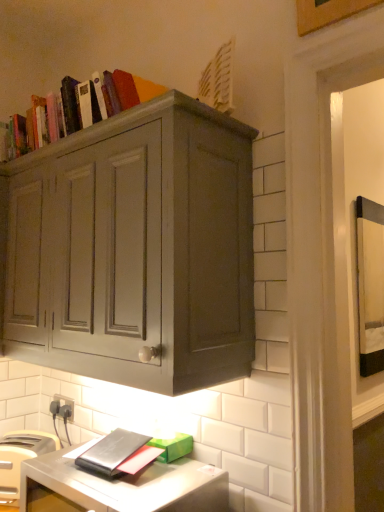
Question: Is wooden picture frame at upper right wider than matte gray cabinet at upper center?

Choices:
 (A) yes
 (B) no

Answer: (B)

Question: Is wooden picture frame at upper right with matte gray cabinet at upper center?

Choices:
 (A) no
 (B) yes

Answer: (A)

Question: Is the position of wooden picture frame at upper right more distant than that of matte gray cabinet at upper center?

Choices:
 (A) no
 (B) yes

Answer: (B)

Question: Could you tell me if wooden picture frame at upper right is turned towards matte gray cabinet at upper center?

Choices:
 (A) no
 (B) yes

Answer: (A)

Question: Is wooden picture frame at upper right not close to matte gray cabinet at upper center?

Choices:
 (A) yes
 (B) no

Answer: (B)

Question: From the image's perspective, is wooden picture frame at upper right positioned above or below white plastic toaster at lower left?

Choices:
 (A) above
 (B) below

Answer: (A)

Question: Is wooden picture frame at upper right wider or thinner than white plastic toaster at lower left?

Choices:
 (A) thin
 (B) wide

Answer: (A)

Question: Based on their positions, is wooden picture frame at upper right located to the left or right of white plastic toaster at lower left?

Choices:
 (A) left
 (B) right

Answer: (B)

Question: Considering the positions of wooden picture frame at upper right and white plastic toaster at lower left in the image, is wooden picture frame at upper right taller or shorter than white plastic toaster at lower left?

Choices:
 (A) short
 (B) tall

Answer: (B)

Question: Considering the positions of black plastic electric outlet at lower left and white plastic toaster at lower left in the image, is black plastic electric outlet at lower left taller or shorter than white plastic toaster at lower left?

Choices:
 (A) short
 (B) tall

Answer: (A)

Question: From the image's perspective, is black plastic electric outlet at lower left located above or below white plastic toaster at lower left?

Choices:
 (A) above
 (B) below

Answer: (A)

Question: From a real-world perspective, is black plastic electric outlet at lower left positioned above or below white plastic toaster at lower left?

Choices:
 (A) above
 (B) below

Answer: (A)

Question: Is black plastic electric outlet at lower left situated inside white plastic toaster at lower left or outside?

Choices:
 (A) outside
 (B) inside

Answer: (A)

Question: Is wooden picture frame at upper right spatially inside matte gray cabinet at upper center, or outside of it?

Choices:
 (A) outside
 (B) inside

Answer: (A)

Question: Based on their sizes in the image, would you say wooden picture frame at upper right is bigger or smaller than matte gray cabinet at upper center?

Choices:
 (A) big
 (B) small

Answer: (B)